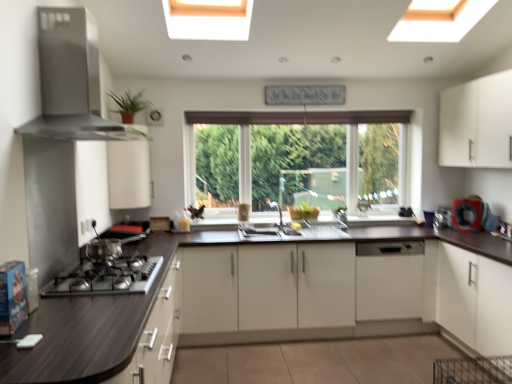
Where is `free space above white glossy sink at center (from a real-world perspective)`? The width and height of the screenshot is (512, 384). free space above white glossy sink at center (from a real-world perspective) is located at coordinates (283, 231).